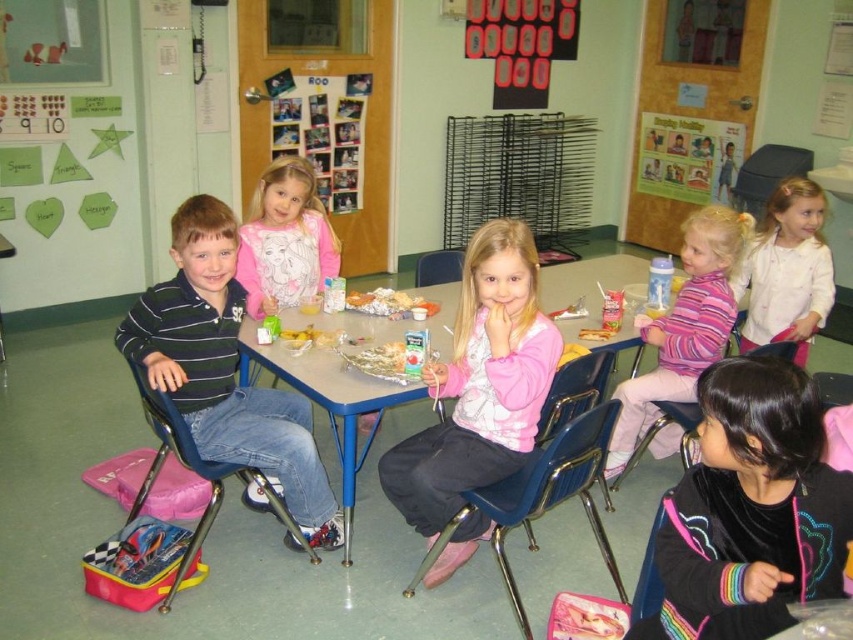
Question: Which object appears farthest from the camera in this image?

Choices:
 (A) metallic blue chair at left
 (B) crumbly golden cookies at center
 (C) blue plastic chair at lower center

Answer: (B)

Question: Based on their relative distances, which object is nearer to the pink fleece jacket at upper right?

Choices:
 (A) blue plastic chair at lower center
 (B) pink fleece jacket at center

Answer: (A)

Question: From the image, what is the correct spatial relationship of metallic blue chair at left in relation to crumbly golden cookies at center?

Choices:
 (A) above
 (B) below

Answer: (B)

Question: Where is pink fleece jacket at center located in relation to shiny plastic bag at table center in the image?

Choices:
 (A) above
 (B) below

Answer: (B)

Question: Does pink fleece jacket at center have a larger size compared to blue plastic chair at center?

Choices:
 (A) yes
 (B) no

Answer: (A)

Question: Which object is farther from the camera taking this photo?

Choices:
 (A) striped cotton shirt at center
 (B) pink fleece jacket at upper right

Answer: (B)